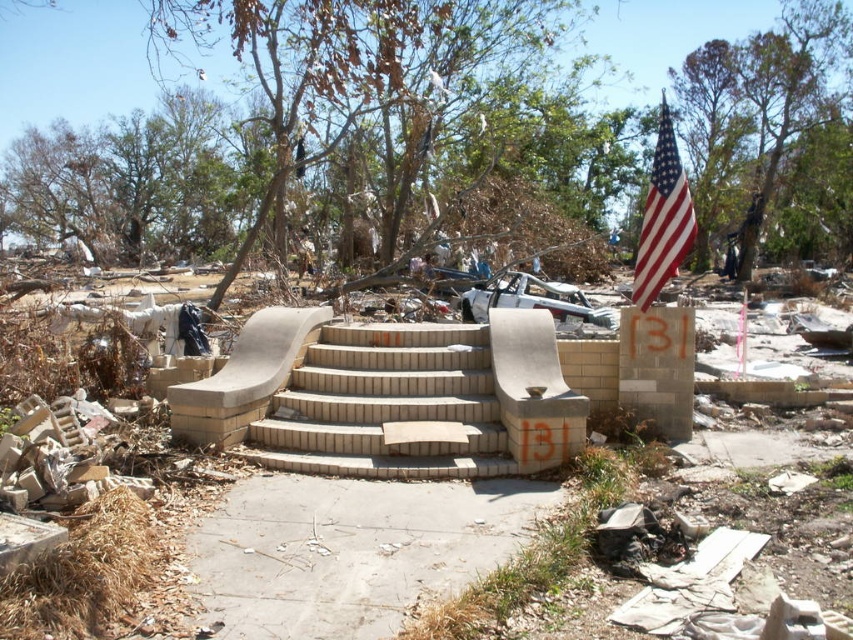
Is beige brick stairs at center thinner than american flag at upper right?

Yes, beige brick stairs at center is thinner than american flag at upper right.

Identify the location of beige brick stairs at center. (387, 404).

At what (x,y) coordinates should I click in order to perform the action: click on beige brick stairs at center. Please return your answer as a coordinate pair (x, y). This screenshot has height=640, width=853. Looking at the image, I should click on pyautogui.click(x=387, y=404).

Between point (405, 541) and point (672, 276), which one is positioned in front?

Point (405, 541) is in front.

From the picture: Does gray concrete sidewalk at center have a greater height compared to american flag at upper right?

In fact, gray concrete sidewalk at center may be shorter than american flag at upper right.

This screenshot has width=853, height=640. In order to click on gray concrete sidewalk at center in this screenshot , I will do `click(349, 550)`.

Can you confirm if gray concrete sidewalk at center is positioned above beige brick stairs at center?

Incorrect, gray concrete sidewalk at center is not positioned above beige brick stairs at center.

Is point (260, 595) behind point (461, 353)?

No, it is not.

Who is more forward, (x=202, y=522) or (x=440, y=465)?

Point (x=202, y=522)

Locate an element on the screen. Image resolution: width=853 pixels, height=640 pixels. gray concrete sidewalk at center is located at coordinates (349, 550).